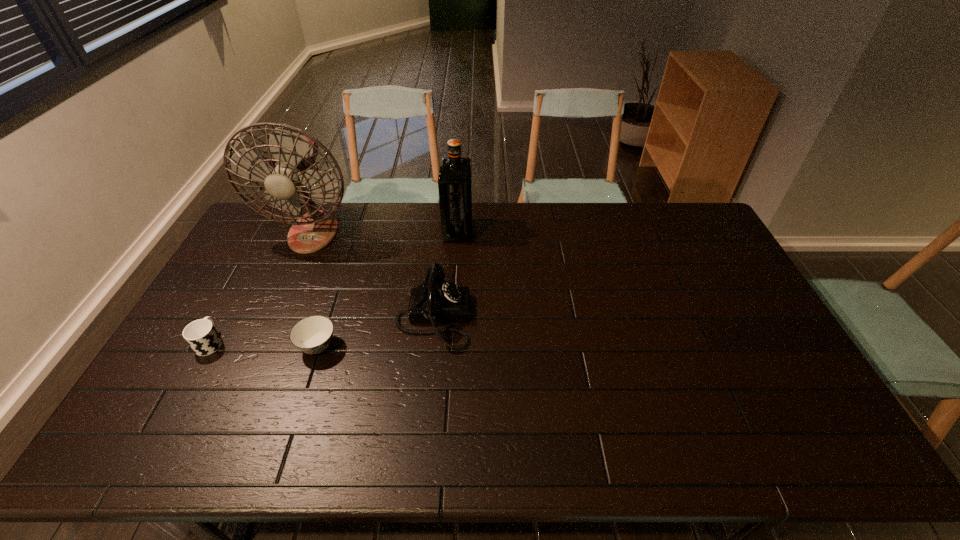
The height and width of the screenshot is (540, 960). I want to click on free location at the far right corner of the desktop, so click(x=684, y=220).

In order to click on vacant area that lies between the cup and the fourth shortest object in this screenshot , I will do `click(334, 286)`.

This screenshot has height=540, width=960. In order to click on free point between the fan and the cup in this screenshot , I will do `click(262, 287)`.

What are the coordinates of `free point between the soup bowl and the liquor` in the screenshot? It's located at (388, 288).

In order to click on vacant space in between the telephone and the soup bowl in this screenshot , I will do `click(375, 332)`.

The width and height of the screenshot is (960, 540). I want to click on free spot between the cup and the tallest object, so click(x=262, y=287).

Locate an element on the screen. Image resolution: width=960 pixels, height=540 pixels. free space between the cup and the second tallest object is located at coordinates (334, 286).

At what (x,y) coordinates should I click in order to perform the action: click on vacant space in between the tallest object and the shortest object. Please return your answer as a coordinate pair (x, y). Looking at the image, I should click on (316, 289).

Locate an element on the screen. The width and height of the screenshot is (960, 540). free space between the fan and the soup bowl is located at coordinates (316, 289).

The image size is (960, 540). In order to click on empty space between the cup and the shortest object in this screenshot , I will do `click(264, 344)`.